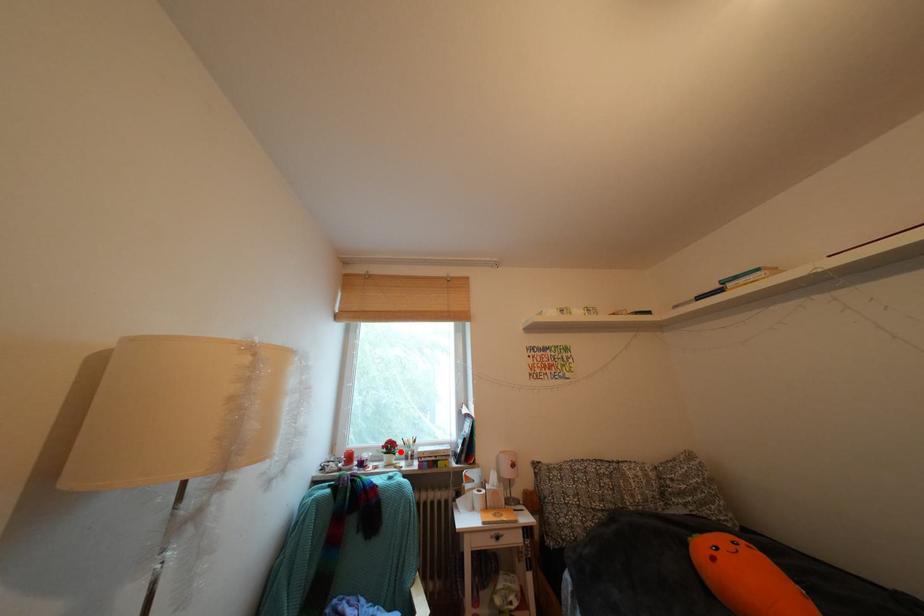
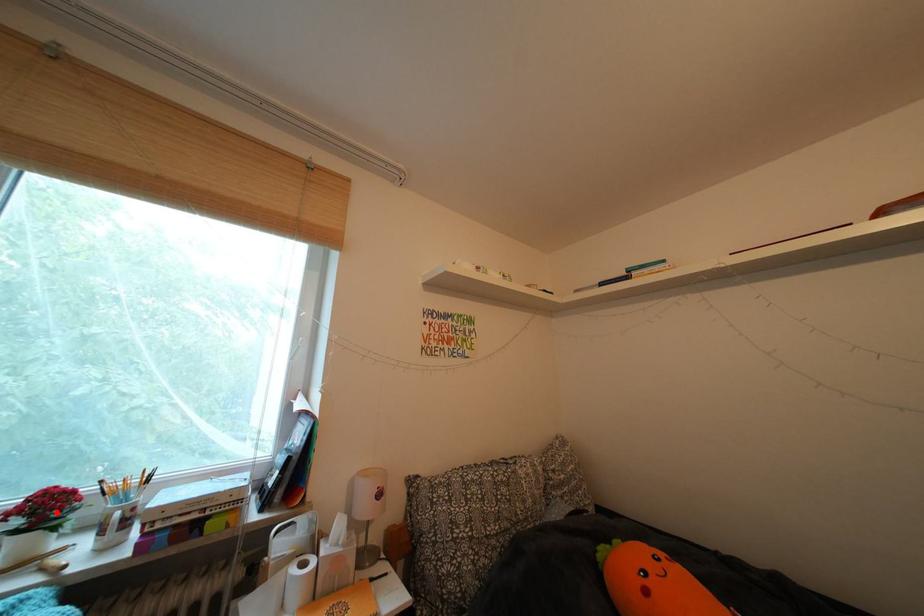
I am providing you with two images of the same scene from different viewpoints. A red point is marked on the first image and another point is marked on the second image. Does the point marked in image1 correspond to the same location as the one in image2?

Yes